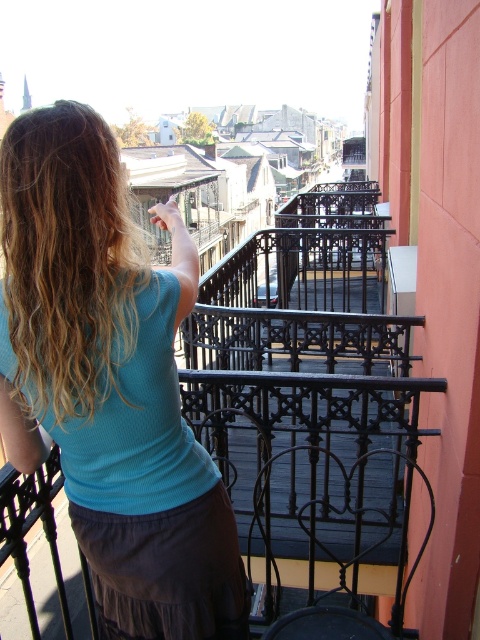
Question: Is teal ribbed tank top at upper left in front of blonde wavy hair at upper left?

Choices:
 (A) no
 (B) yes

Answer: (B)

Question: Which object is farther from the camera taking this photo?

Choices:
 (A) teal ribbed tank top at upper left
 (B) blonde wavy hair at upper left

Answer: (B)

Question: Does teal ribbed tank top at upper left have a greater width compared to blonde wavy hair at upper left?

Choices:
 (A) yes
 (B) no

Answer: (A)

Question: Among these objects, which one is nearest to the camera?

Choices:
 (A) blonde wavy hair at upper left
 (B) teal ribbed tank top at upper left

Answer: (B)

Question: Does teal ribbed tank top at upper left appear on the left side of blonde wavy hair at upper left?

Choices:
 (A) yes
 (B) no

Answer: (B)

Question: Which point is closer to the camera taking this photo?

Choices:
 (A) (31, 256)
 (B) (59, 156)

Answer: (B)